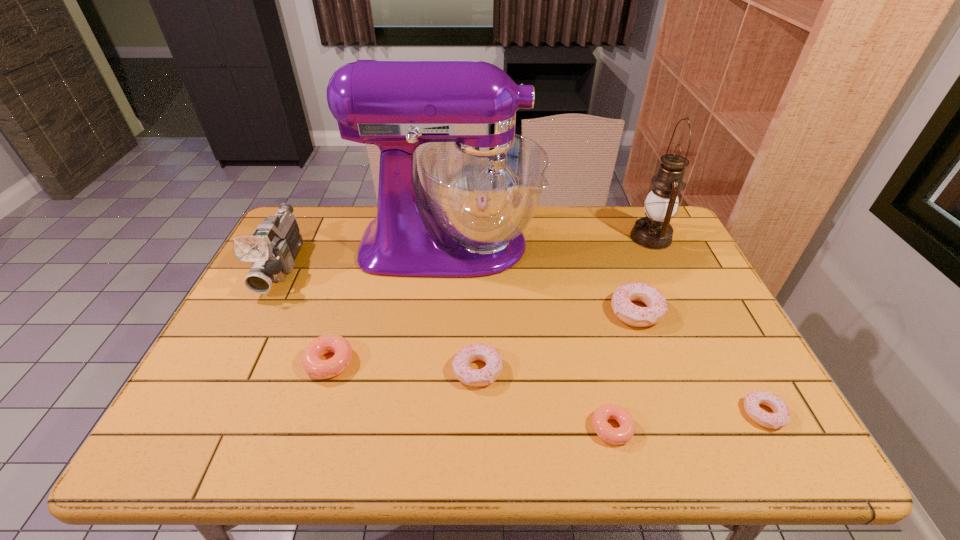
At what (x,y) coordinates should I click in order to perform the action: click on the tallest object. Please return your answer as a coordinate pair (x, y). Looking at the image, I should click on (483, 183).

This screenshot has height=540, width=960. What are the coordinates of `mixer` in the screenshot? It's located at (483, 183).

I want to click on brown oil lamp, so click(x=654, y=231).

Find the location of `oil lamp`. oil lamp is located at coordinates (654, 231).

You are a GUI agent. You are given a task and a screenshot of the screen. Output one action in this format:
    pyautogui.click(x=<x>, y=<y>)
    Task: Click on the sixth shortest object
    The width and height of the screenshot is (960, 540).
    Given the screenshot: What is the action you would take?
    pyautogui.click(x=271, y=250)

I want to click on camcorder, so click(271, 250).

Locate an element on the screen. The width and height of the screenshot is (960, 540). the tallest doughnut is located at coordinates (631, 314).

The width and height of the screenshot is (960, 540). Find the location of `the second doughnut from right to left`. the second doughnut from right to left is located at coordinates (631, 314).

At what (x,y) coordinates should I click in order to perform the action: click on the left pink doughnut. Please return your answer as a coordinate pair (x, y). Looking at the image, I should click on (315, 367).

Where is `the bigger pink doughnut`? The image size is (960, 540). the bigger pink doughnut is located at coordinates (315, 367).